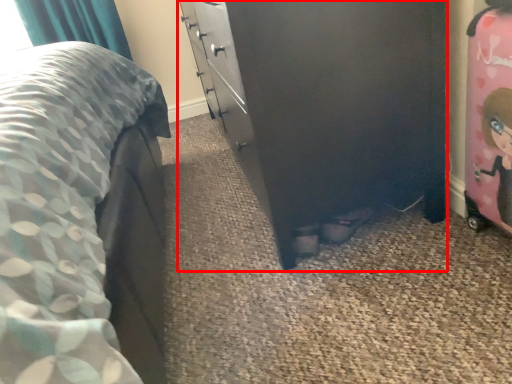
Question: From the image's perspective, considering the relative positions of chest of drawers (annotated by the red box) and toy in the image provided, where is chest of drawers (annotated by the red box) located with respect to the staircase?

Choices:
 (A) above
 (B) below

Answer: (A)